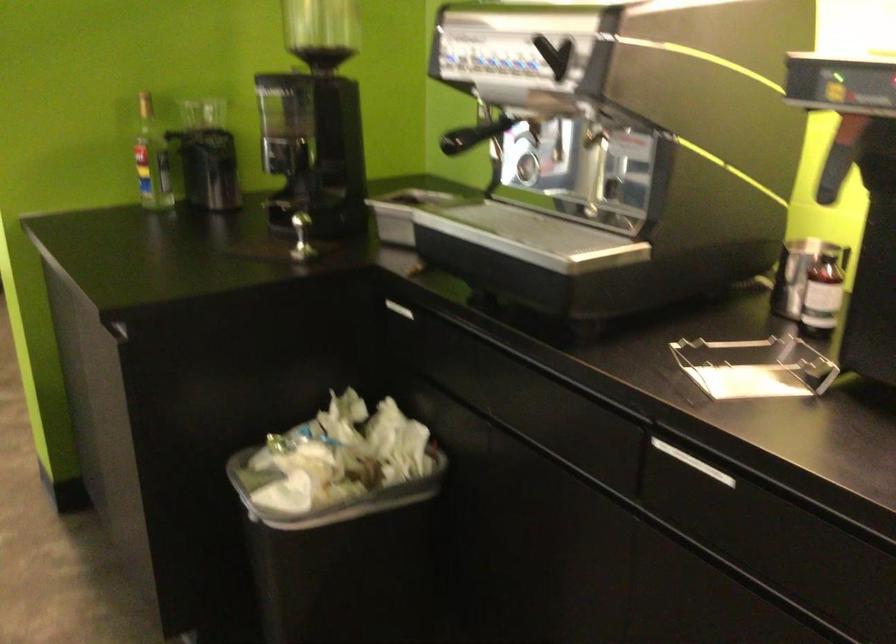
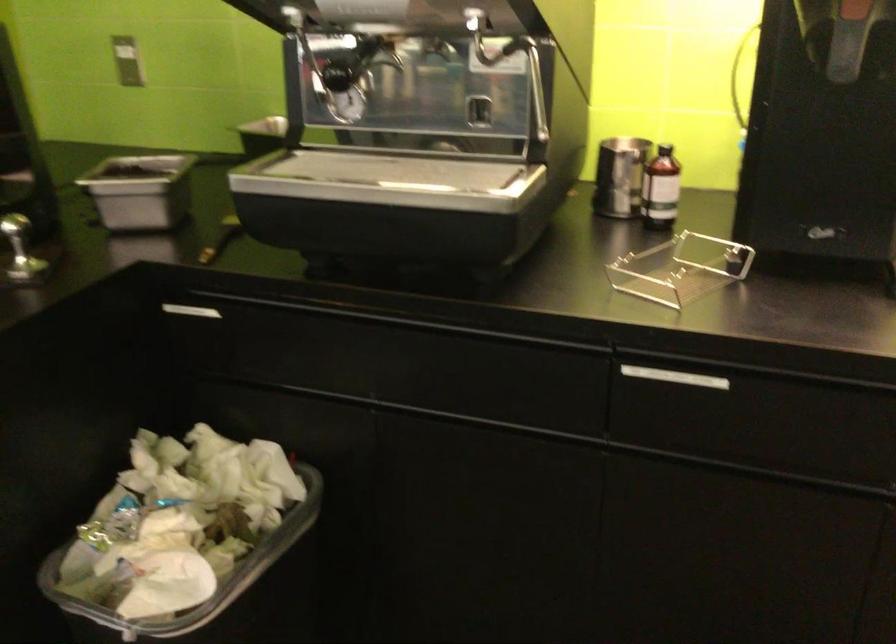
The point at (314,509) is marked in the first image. Where is the corresponding point in the second image?

(218, 592)